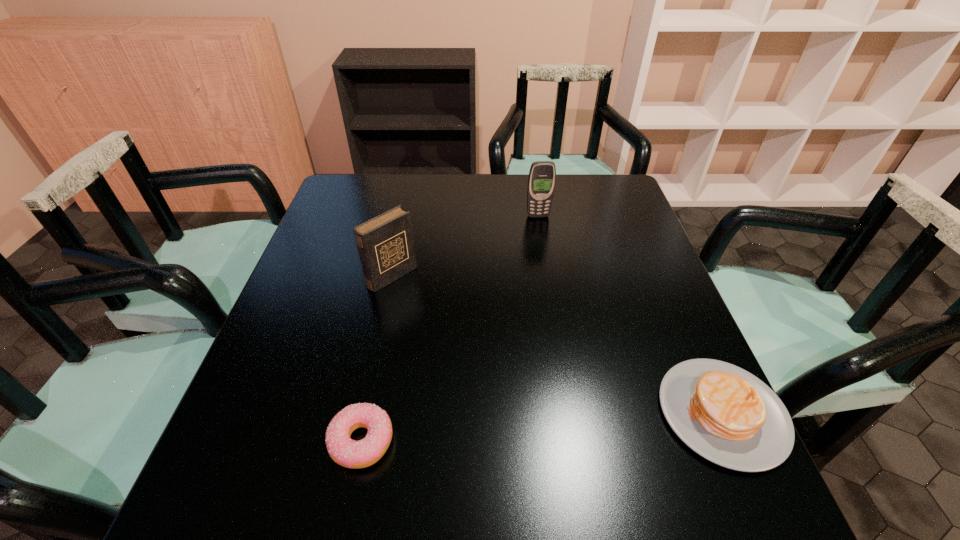
The width and height of the screenshot is (960, 540). Find the location of `vacant area at the near edge of the desktop`. vacant area at the near edge of the desktop is located at coordinates (478, 436).

At what (x,y) coordinates should I click in order to perform the action: click on vacant region at the right edge of the desktop. Please return your answer as a coordinate pair (x, y). Looking at the image, I should click on (656, 395).

The height and width of the screenshot is (540, 960). Find the location of `free space at the near left corner`. free space at the near left corner is located at coordinates (283, 418).

This screenshot has width=960, height=540. In order to click on free space at the far right corner of the desktop in this screenshot , I will do `click(594, 177)`.

You are a GUI agent. You are given a task and a screenshot of the screen. Output one action in this format:
    pyautogui.click(x=<x>, y=<y>)
    Task: Click on the free area in between the cellular telephone and the third tallest object
    The width and height of the screenshot is (960, 540).
    Given the screenshot: What is the action you would take?
    pyautogui.click(x=630, y=314)

This screenshot has height=540, width=960. What are the coordinates of `vacant area that lies between the second farthest object and the second shortest object` in the screenshot? It's located at (557, 345).

Image resolution: width=960 pixels, height=540 pixels. Find the location of `vacant space in between the pancake and the farthest object`. vacant space in between the pancake and the farthest object is located at coordinates (630, 314).

Where is `free space between the rightmost object and the diary`? This screenshot has height=540, width=960. free space between the rightmost object and the diary is located at coordinates (557, 345).

Where is `free space between the cellular telephone and the rightmost object`? The image size is (960, 540). free space between the cellular telephone and the rightmost object is located at coordinates (630, 314).

Image resolution: width=960 pixels, height=540 pixels. Identify the location of free area in between the second farthest object and the cellular telephone. click(x=466, y=246).